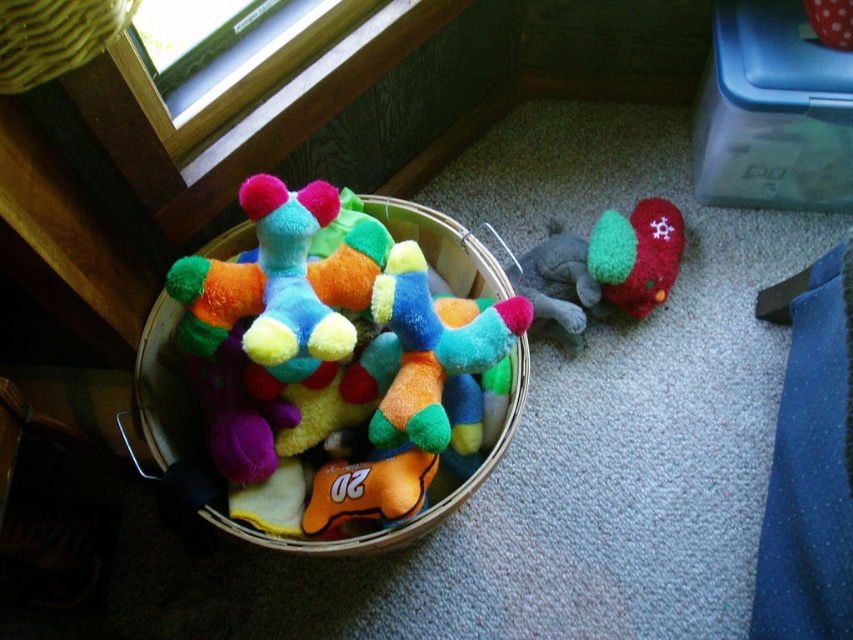
You are organizing a toy drive and need to determine if the soft fabric stuffed animals at center can fit into the yellow woven basket at upper left. Based on their sizes, what would you conclude?

The soft fabric stuffed animals at center has a larger size compared to the yellow woven basket at upper left, so they cannot fit inside the basket.

You are organizing a toy room and need to move the velvety green plush toy at lower right. Can you lift it without moving the yellow woven basket at upper left?

The yellow woven basket at upper left is positioned over the velvety green plush toy at lower right, so you cannot lift the velvety green plush toy at lower right without moving the yellow woven basket at upper left first.